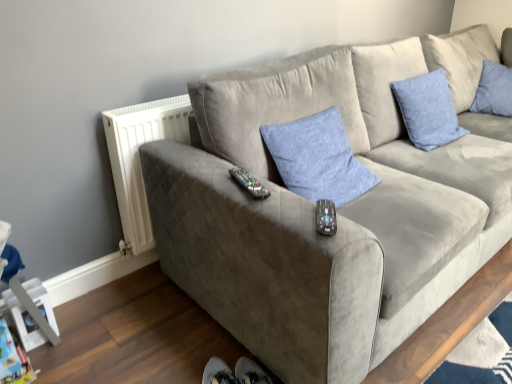
Question: Is suede gray couch at center located within blue fabric pillow at center, which appears as the 2th pillow when viewed from the back?

Choices:
 (A) yes
 (B) no

Answer: (B)

Question: From the image's perspective, is blue fabric pillow at center, the first pillow in the left-to-right sequence, beneath suede gray couch at center?

Choices:
 (A) no
 (B) yes

Answer: (B)

Question: Does blue fabric pillow at center, the 2th pillow viewed from the right, appear on the right side of suede gray couch at center?

Choices:
 (A) yes
 (B) no

Answer: (B)

Question: Is blue fabric pillow at center, marked as the 1th pillow in a front-to-back arrangement, positioned far away from suede gray couch at center?

Choices:
 (A) yes
 (B) no

Answer: (B)

Question: Is blue fabric pillow at center, which appears as the 2th pillow when viewed from the back, facing towards suede gray couch at center?

Choices:
 (A) yes
 (B) no

Answer: (A)

Question: Is blue fabric pillow at center, marked as the 1th pillow in a front-to-back arrangement, further to the viewer compared to suede gray couch at center?

Choices:
 (A) yes
 (B) no

Answer: (A)

Question: Can you confirm if blue fabric pillow at center, which appears as the 2th pillow when viewed from the back, is shorter than black plastic remote at center, acting as the 2th remote starting from the right?

Choices:
 (A) yes
 (B) no

Answer: (B)

Question: Is blue fabric pillow at center, which appears as the 2th pillow when viewed from the back, touching black plastic remote at center, acting as the 1th remote starting from the left?

Choices:
 (A) yes
 (B) no

Answer: (B)

Question: Is blue fabric pillow at center, marked as the 1th pillow in a front-to-back arrangement, oriented towards black plastic remote at center, marked as the second remote in a bottom-to-top arrangement?

Choices:
 (A) no
 (B) yes

Answer: (A)

Question: Can you confirm if blue fabric pillow at center, marked as the 1th pillow in a front-to-back arrangement, is bigger than black plastic remote at center, acting as the 2th remote starting from the right?

Choices:
 (A) no
 (B) yes

Answer: (B)

Question: Does blue fabric pillow at center, marked as the 1th pillow in a front-to-back arrangement, have a smaller size compared to black plastic remote at center, acting as the 2th remote starting from the right?

Choices:
 (A) yes
 (B) no

Answer: (B)

Question: Is blue fabric pillow at center, marked as the 1th pillow in a front-to-back arrangement, not inside black plastic remote at center, the first remote when ordered from back to front?

Choices:
 (A) yes
 (B) no

Answer: (A)

Question: Considering the relative positions of black plastic remote at center, acting as the 2th remote starting from the right, and white plastic radiator at left in the image provided, is black plastic remote at center, acting as the 2th remote starting from the right, behind white plastic radiator at left?

Choices:
 (A) yes
 (B) no

Answer: (B)